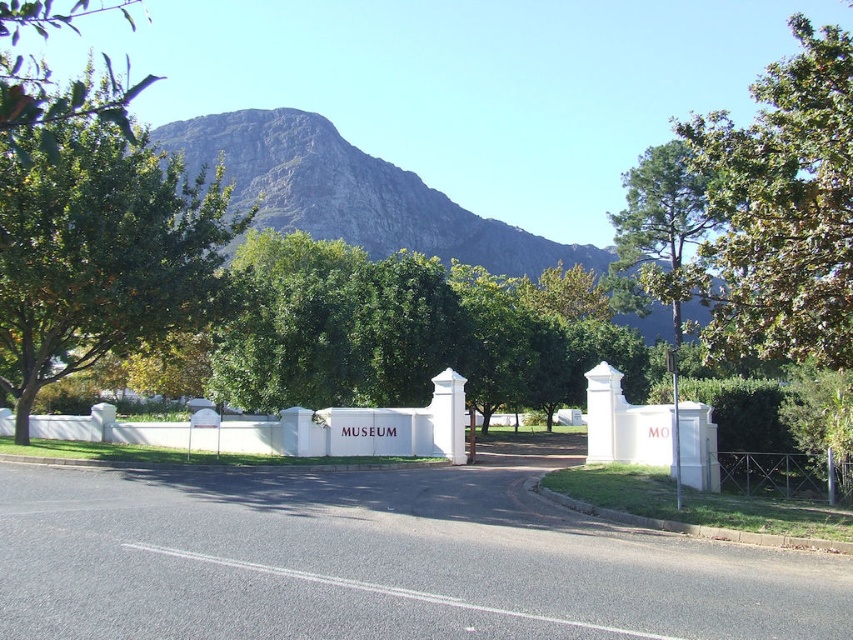
Question: Is gray rocky mountain at upper center behind green leafy hedge at center?

Choices:
 (A) no
 (B) yes

Answer: (B)

Question: Where is green leafy tree at upper right located in relation to green leafy hedge at center in the image?

Choices:
 (A) above
 (B) below

Answer: (A)

Question: Does green leafy tree at upper left come behind metallic wire fence at right?

Choices:
 (A) yes
 (B) no

Answer: (B)

Question: Which is nearer to the gray rocky mountain at upper center?

Choices:
 (A) green leafy hedge at center
 (B) green leafy tree at upper right
 (C) green leafy tree at upper left

Answer: (C)

Question: Which object is positioned closest to the green leafy tree at upper right?

Choices:
 (A) green leafy hedge at center
 (B) metallic wire fence at right
 (C) green leafy tree at upper left

Answer: (A)

Question: Which object is positioned farthest from the green leafy hedge at center?

Choices:
 (A) metallic wire fence at right
 (B) green leafy tree at upper right

Answer: (B)